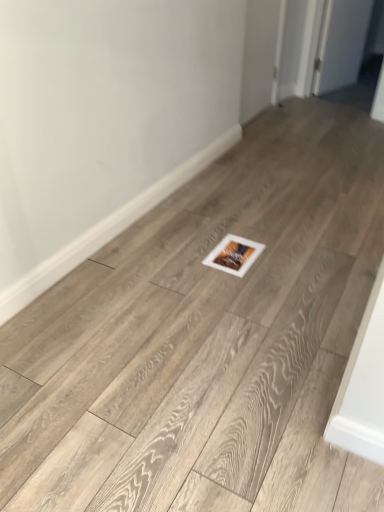
Identify the location of free location in front of white matte picture frame at center. (238, 280).